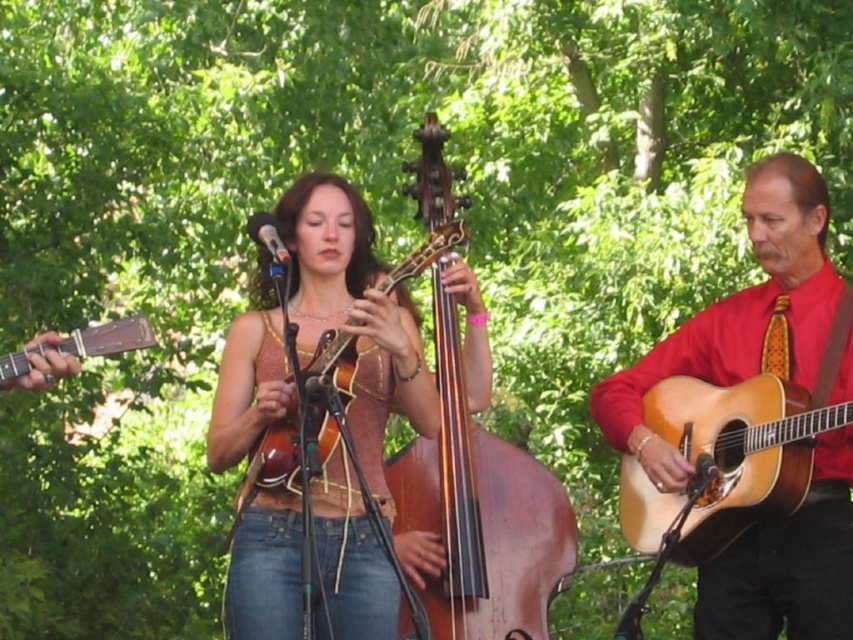
You are a photographer at the live musical performance. You want to take a photo that includes both the red satin shirt at right and the brown polished wood cello at center. Which one will appear larger in the photo?

The red satin shirt at right will appear larger in the photo because it is closer to the viewer than the brown polished wood cello at center.

You are a stagehand setting up equipment for the performance. You need to place the brown polished wood cello at center and the metallic blue microphone at center side by side on a narrow platform. Which one should you place first to ensure they both fit?

The brown polished wood cello at center is wider than the metallic blue microphone at center, so you should place the brown polished wood cello at center first to ensure both fit on the narrow platform.

You are a photographer at the event and want to capture both the red satin shirt at right and the brown polished wood cello at center in a single frame. Given that your camera has a fixed focal length, which object should you position closer to the camera to ensure both are in focus?

The red satin shirt at right is larger in size than the brown polished wood cello at center. To ensure both are in focus, position the red satin shirt at right closer to the camera since larger objects require being nearer to maintain focus in the same plane.